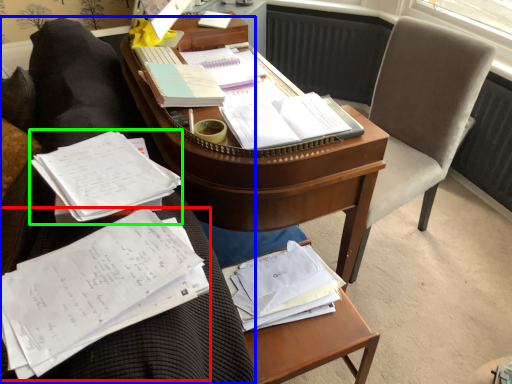
Question: Considering the real-world distances, which object is farthest from document (highlighted by a red box)? furniture (highlighted by a blue box) or book (highlighted by a green box)?

Choices:
 (A) furniture
 (B) book

Answer: (A)